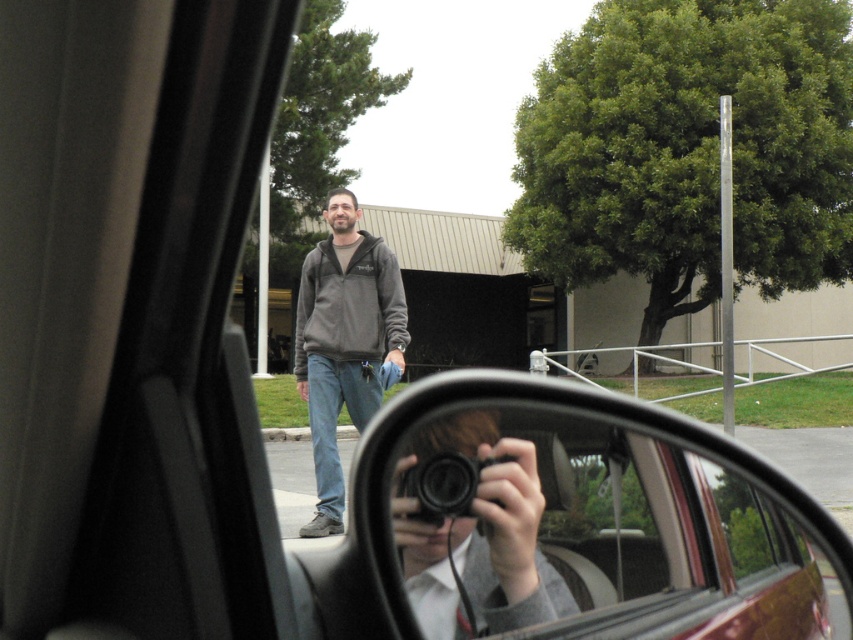
Question: From the image, what is the correct spatial relationship of dark gray hoodie at center in relation to black plastic camera at center?

Choices:
 (A) left
 (B) right

Answer: (A)

Question: Which point appears closest to the camera in this image?

Choices:
 (A) (579, 532)
 (B) (448, 480)
 (C) (351, 244)

Answer: (B)

Question: Is shiny black mirror at center bigger than dark gray hoodie at center?

Choices:
 (A) no
 (B) yes

Answer: (B)

Question: Which object appears farthest from the camera in this image?

Choices:
 (A) black plastic camera at center
 (B) shiny black mirror at center
 (C) dark gray hoodie at center

Answer: (C)

Question: Among these objects, which one is nearest to the camera?

Choices:
 (A) black plastic camera at center
 (B) dark gray hoodie at center

Answer: (A)

Question: Is shiny black mirror at center thinner than black plastic camera at center?

Choices:
 (A) no
 (B) yes

Answer: (A)